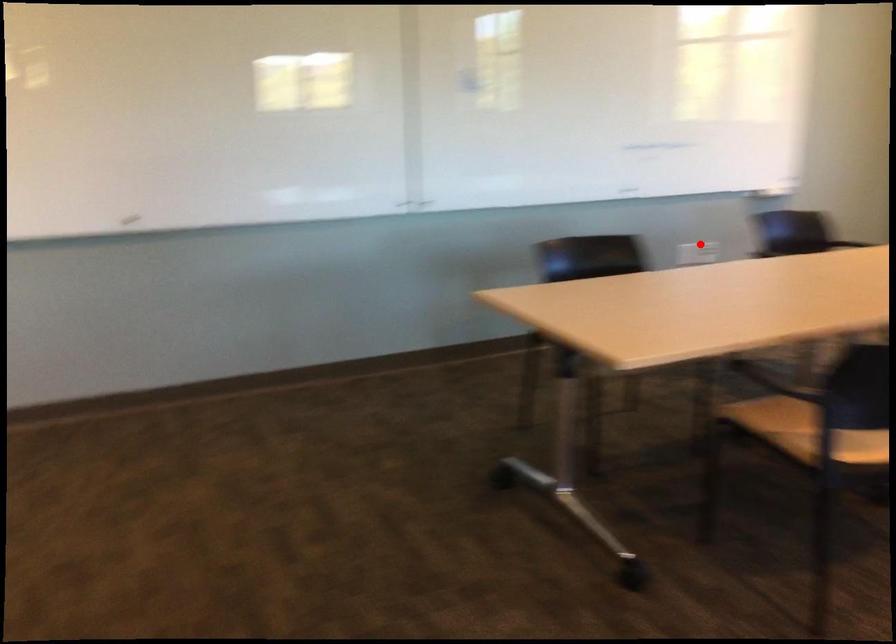
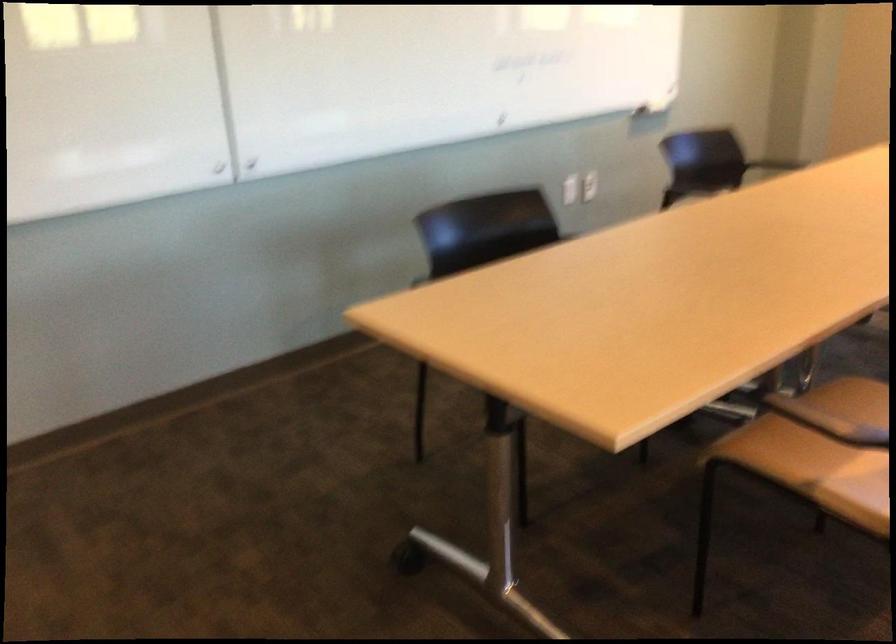
Where in the second image is the point corresponding to the highlighted location from the first image?

(589, 185)